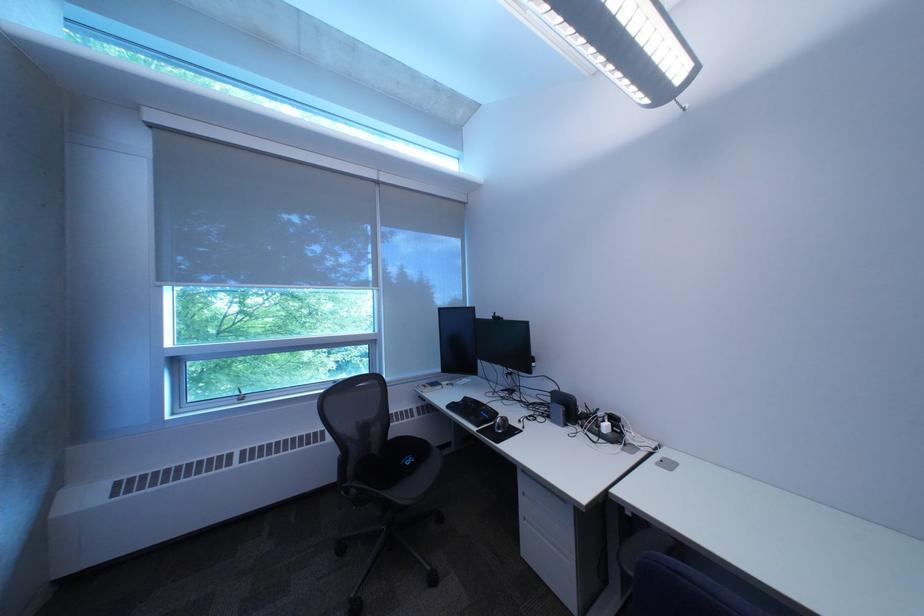
This screenshot has width=924, height=616. I want to click on window latch handle, so (239, 394).